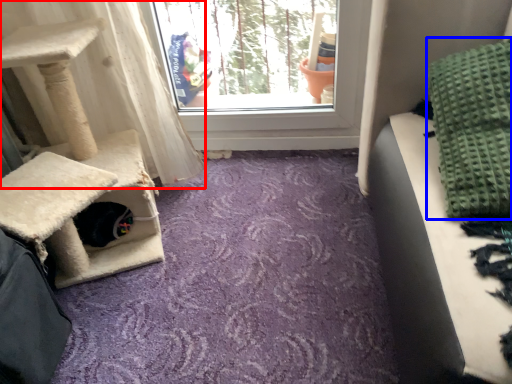
Question: Which point is further to the camera, curtain (highlighted by a red box) or blanket (highlighted by a blue box)?

Choices:
 (A) curtain
 (B) blanket

Answer: (A)